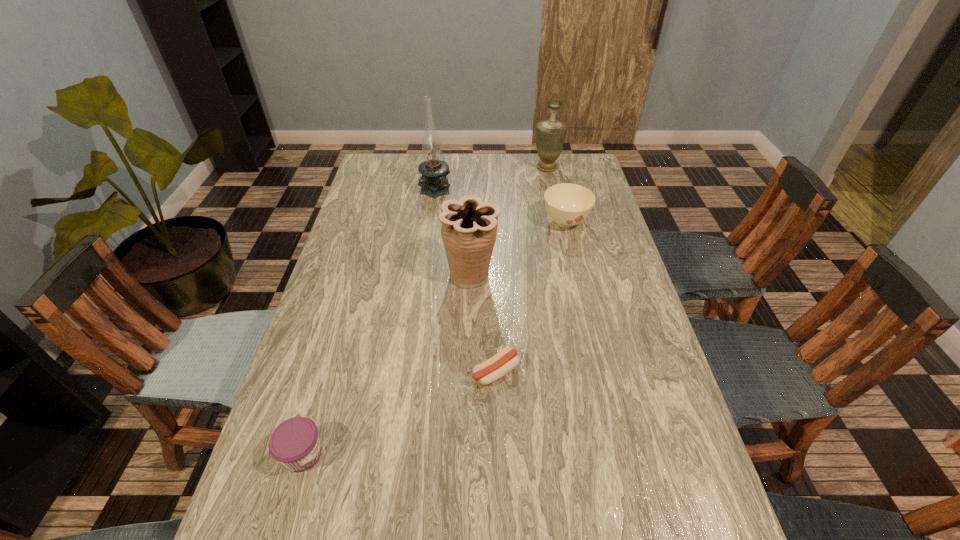
This screenshot has height=540, width=960. What are the coordinates of `vacant region between the second nearest object and the farther urn` in the screenshot? It's located at (521, 269).

Where is `unoccupied area between the third shortest object and the shortest object`? This screenshot has width=960, height=540. unoccupied area between the third shortest object and the shortest object is located at coordinates (531, 297).

Find the location of `vacant region between the fourth nearest object and the left urn`. vacant region between the fourth nearest object and the left urn is located at coordinates (518, 249).

Find the location of a particular element. The image size is (960, 540). vacant area that lies between the nearer urn and the fifth farthest object is located at coordinates (484, 323).

Where is `vacant region between the jam and the right urn`? The image size is (960, 540). vacant region between the jam and the right urn is located at coordinates (425, 310).

Locate an element on the screen. This screenshot has height=540, width=960. the fourth closest object to the oil lamp is located at coordinates (497, 366).

Select which object is the fourth closest to the sausage. Please provide its 2D coordinates. Your answer should be formatted as a tuple, i.e. [(x, y)], where the tuple contains the x and y coordinates of a point satisfying the conditions above.

[(434, 183)]

Identify the location of free space in the image that satisfies the following two spatial constraints: 1. on the front side of the farthest object; 2. on the front label of the second shortest object. This screenshot has height=540, width=960. (608, 454).